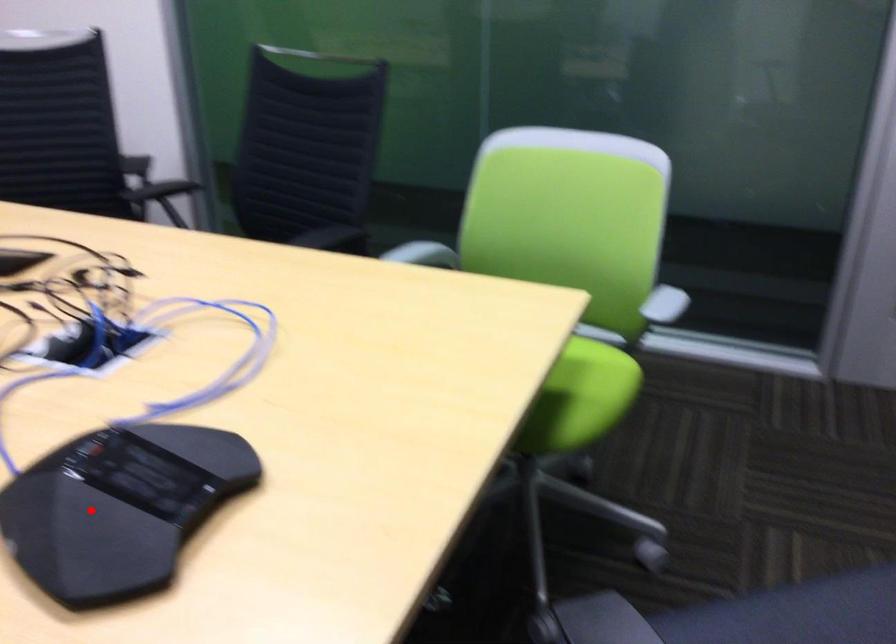
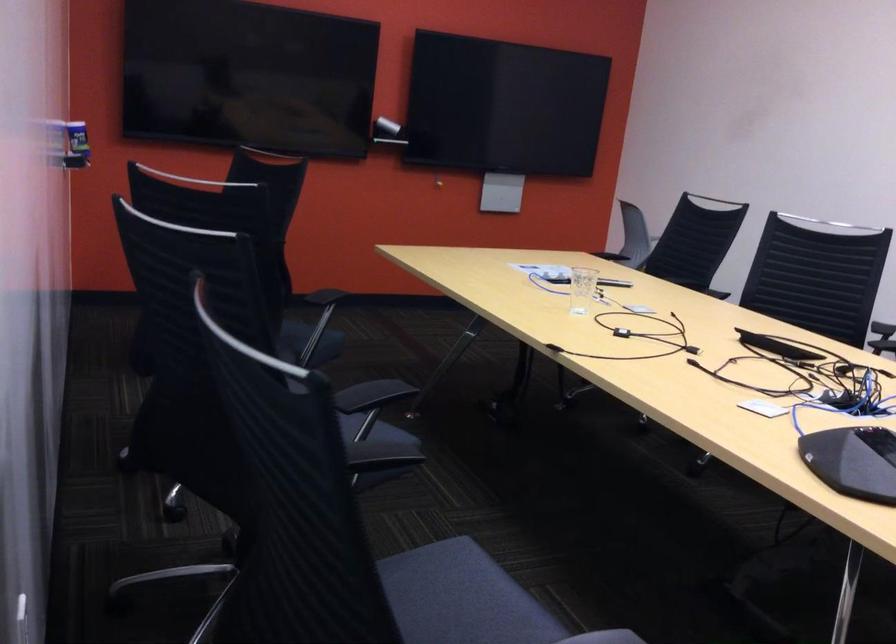
Question: I am providing you with two images of the same scene from different viewpoints. Image1 has a red point marked. In image2, the corresponding 3D location appears at what relative position? Reply with the corresponding letter.

Choices:
 (A) Closer
 (B) Farther

Answer: (B)